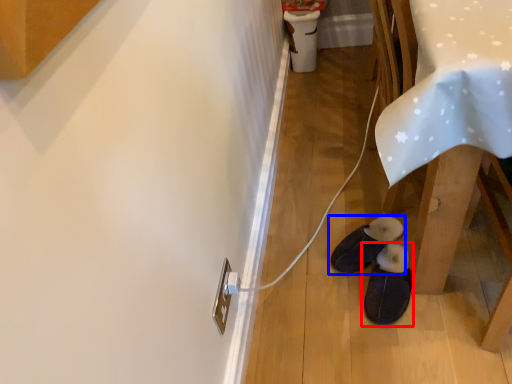
Question: Which object is closer to the camera taking this photo, footwear (highlighted by a red box) or footwear (highlighted by a blue box)?

Choices:
 (A) footwear
 (B) footwear

Answer: (A)